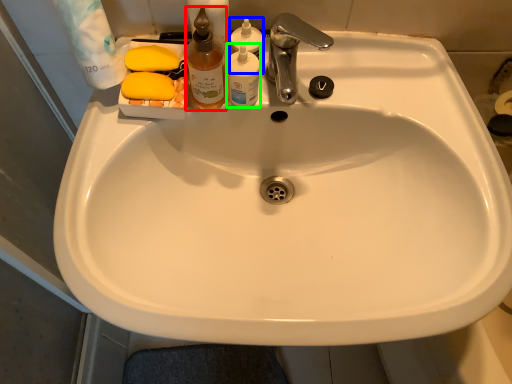
Question: Considering the real-world distances, which object is closest to cleaning product (highlighted by a red box)? cleaning product (highlighted by a blue box) or toiletry (highlighted by a green box).

Choices:
 (A) cleaning product
 (B) toiletry

Answer: (B)